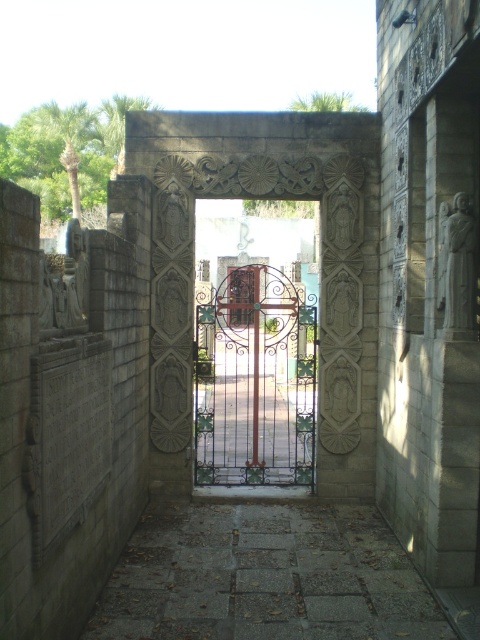
Question: From the image, what is the correct spatial relationship of carved stone archway at center in relation to metallic wrought iron gate at center?

Choices:
 (A) below
 (B) above

Answer: (B)

Question: Which of the following is the farthest from the observer?

Choices:
 (A) (333, 218)
 (B) (277, 289)

Answer: (B)

Question: Does carved stone archway at center lie behind metallic wrought iron gate at center?

Choices:
 (A) yes
 (B) no

Answer: (A)

Question: Does carved stone archway at center come behind metallic wrought iron gate at center?

Choices:
 (A) yes
 (B) no

Answer: (A)

Question: Which point is closer to the camera?

Choices:
 (A) carved stone archway at center
 (B) metallic wrought iron gate at center

Answer: (B)